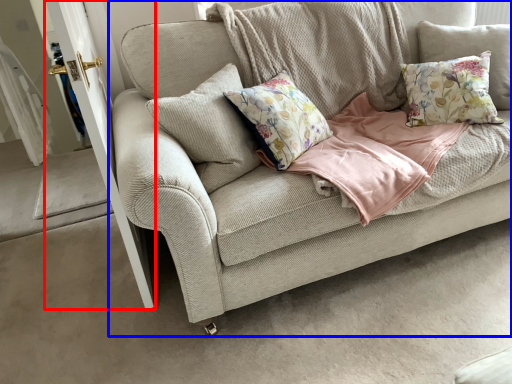
Question: Among these objects, which one is farthest to the camera, screen door (highlighted by a red box) or studio couch (highlighted by a blue box)?

Choices:
 (A) screen door
 (B) studio couch

Answer: (A)